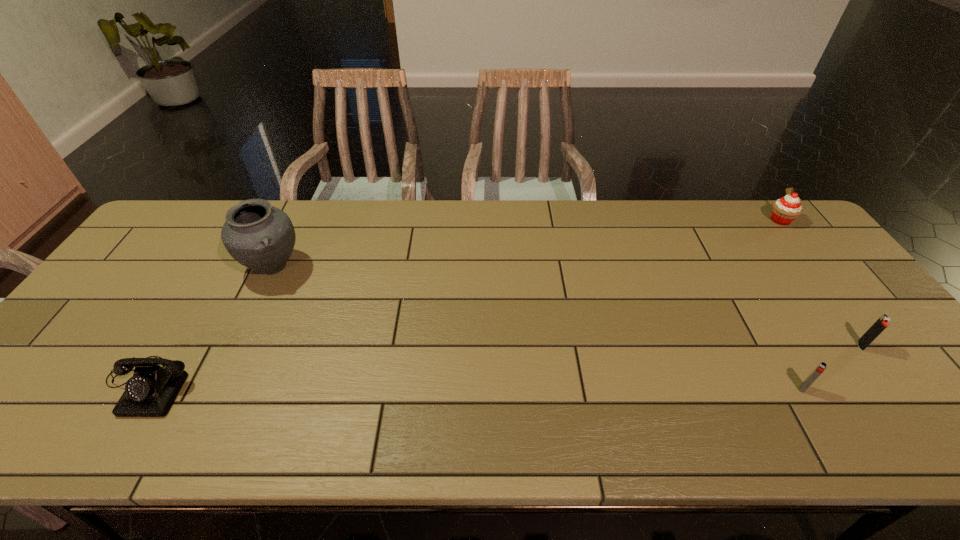
Locate an element on the screen. the second farthest object is located at coordinates (257, 235).

The height and width of the screenshot is (540, 960). What are the coordinates of `urn` in the screenshot? It's located at (257, 235).

Find the location of a particular element. This screenshot has height=540, width=960. cupcake is located at coordinates (785, 210).

Find the location of a particular element. Image resolution: width=960 pixels, height=540 pixels. the farther igniter is located at coordinates (876, 329).

In order to click on the third farthest object in this screenshot , I will do (876, 329).

The height and width of the screenshot is (540, 960). What are the coordinates of `the third object from right to left` in the screenshot? It's located at [x=822, y=366].

I want to click on the left igniter, so click(x=822, y=366).

Locate an element on the screen. The height and width of the screenshot is (540, 960). telephone is located at coordinates (151, 392).

The height and width of the screenshot is (540, 960). In order to click on vacant space located 0.210m on the left of the second farthest object in this screenshot , I will do `click(171, 267)`.

You are a GUI agent. You are given a task and a screenshot of the screen. Output one action in this format:
    pyautogui.click(x=<x>, y=<y>)
    Task: Click on the free point located 0.390m on the front of the farthest object
    This screenshot has width=960, height=540.
    Given the screenshot: What is the action you would take?
    pyautogui.click(x=860, y=323)